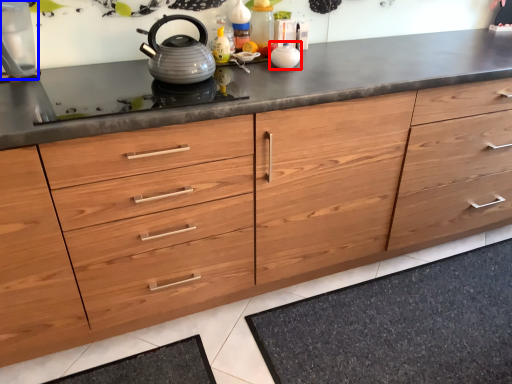
Question: Among these objects, which one is nearest to the camera, appliance (highlighted by a red box) or appliance (highlighted by a blue box)?

Choices:
 (A) appliance
 (B) appliance

Answer: (B)